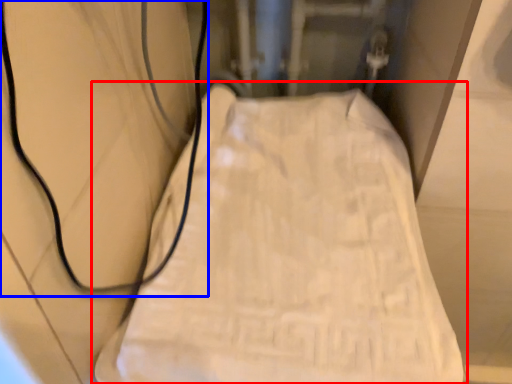
Question: Which of the following is the farthest to the observer, furniture (highlighted by a red box) or wire (highlighted by a blue box)?

Choices:
 (A) furniture
 (B) wire

Answer: (A)